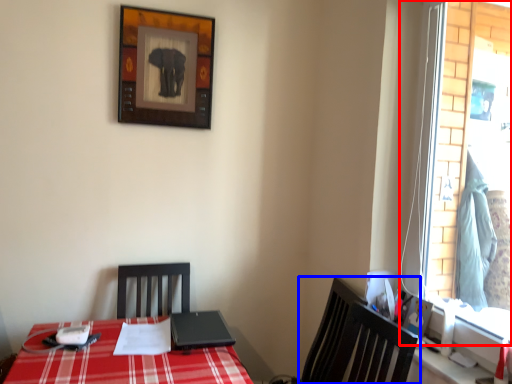
Question: Which of the following is the closest to the observer, window (highlighted by a red box) or chair (highlighted by a blue box)?

Choices:
 (A) window
 (B) chair

Answer: (A)